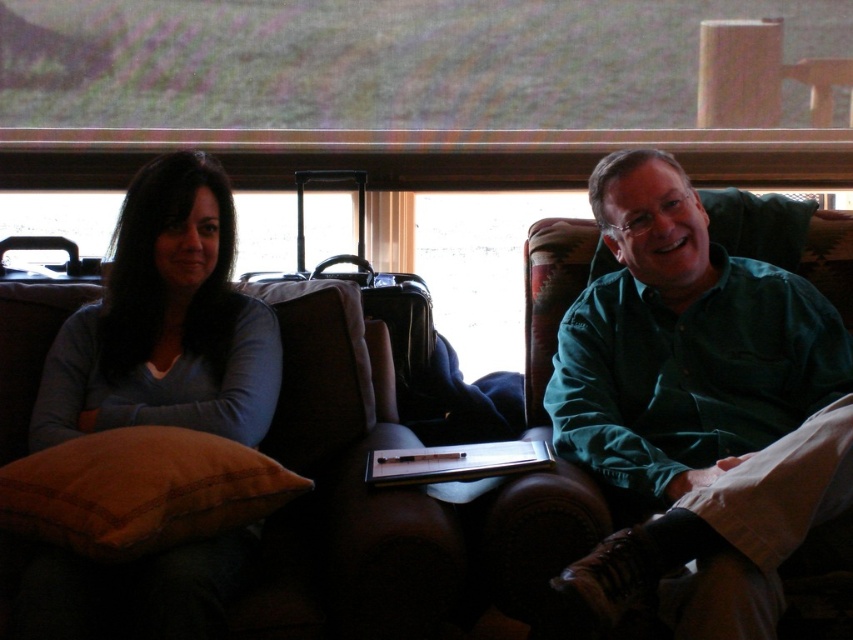
Question: Can you confirm if green cotton shirt at center is positioned to the right of brown velvety pillow at lower left?

Choices:
 (A) no
 (B) yes

Answer: (B)

Question: Among these objects, which one is farthest from the camera?

Choices:
 (A) brown suede couch at left
 (B) green cotton shirt at center

Answer: (A)

Question: Does green cotton shirt at center appear over brown velvety pillow at lower left?

Choices:
 (A) yes
 (B) no

Answer: (A)

Question: Which object is closer to the camera taking this photo?

Choices:
 (A) matte blue shirt at left
 (B) brown velvety pillow at lower left
 (C) green cotton shirt at center
 (D) brown suede couch at left

Answer: (A)

Question: Is green cotton shirt at center to the left of matte blue shirt at left from the viewer's perspective?

Choices:
 (A) no
 (B) yes

Answer: (A)

Question: Which object is closer to the camera taking this photo?

Choices:
 (A) green cotton shirt at center
 (B) brown suede couch at left

Answer: (A)